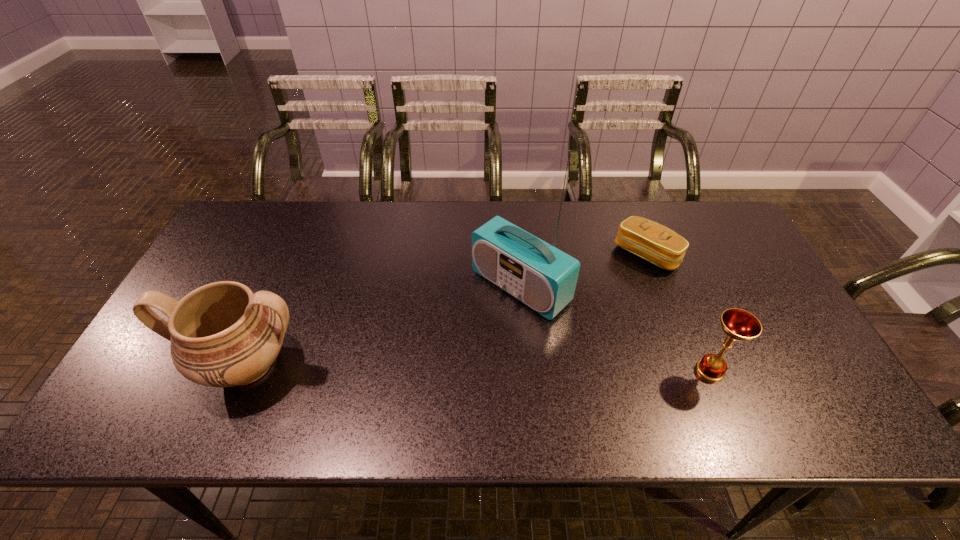
Image resolution: width=960 pixels, height=540 pixels. I want to click on free spot at the left edge of the desktop, so click(252, 268).

This screenshot has width=960, height=540. What are the coordinates of `vacant region at the far left corner` in the screenshot? It's located at (253, 206).

In the image, there is a desktop. Where is `vacant space at the far right corner`? This screenshot has height=540, width=960. vacant space at the far right corner is located at coordinates (726, 220).

I want to click on free space between the shortest object and the leftmost object, so click(x=446, y=309).

The width and height of the screenshot is (960, 540). What are the coordinates of `vacant point located between the shortest object and the tallest object` in the screenshot? It's located at (584, 270).

At what (x,y) coordinates should I click in order to perform the action: click on unoccupied area between the third shortest object and the clutch bag. Please return your answer as a coordinate pair (x, y). Looking at the image, I should click on (446, 309).

The height and width of the screenshot is (540, 960). What are the coordinates of `free space between the shortest object and the urn` in the screenshot? It's located at (446, 309).

This screenshot has height=540, width=960. Find the location of `free point between the urn and the shortest object`. free point between the urn and the shortest object is located at coordinates (446, 309).

Locate an element on the screen. The image size is (960, 540). vacant point located between the radio receiver and the urn is located at coordinates (384, 326).

Locate an element on the screen. This screenshot has height=540, width=960. free area in between the chalice and the urn is located at coordinates (479, 368).